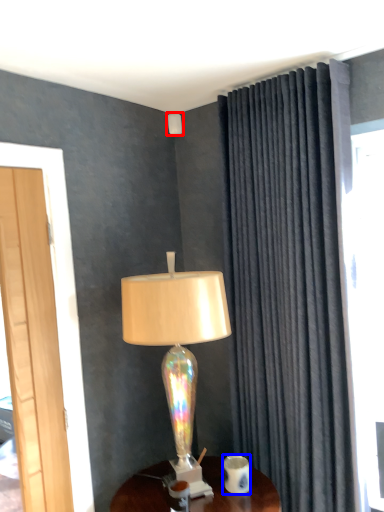
Question: Which object appears closest to the camera in this image, lamp (highlighted by a red box) or coffee cup (highlighted by a blue box)?

Choices:
 (A) lamp
 (B) coffee cup

Answer: (B)